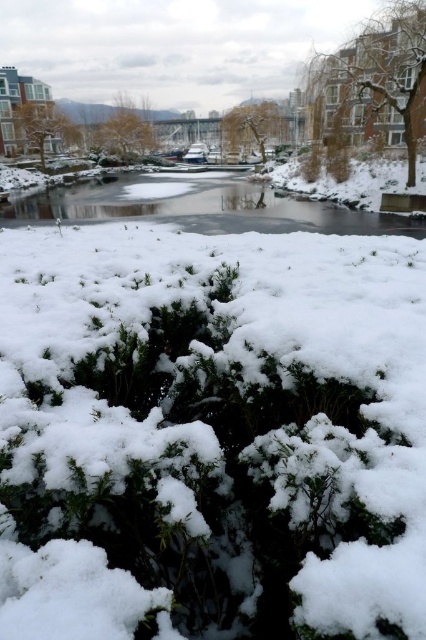
Is point (347, 611) farther from camera compared to point (112, 128)?

No, (347, 611) is in front of (112, 128).

I want to click on white fluffy snow at center, so click(x=212, y=435).

This screenshot has height=640, width=426. I want to click on white fluffy snow at center, so click(212, 435).

Which is more to the right, clear ice water at center or snow-covered tree at upper right?

Positioned to the right is snow-covered tree at upper right.

Locate an element on the screen. The image size is (426, 640). clear ice water at center is located at coordinates (199, 208).

Is point (111, 198) more distant than point (400, 36)?

That is False.

At what (x,y) coordinates should I click in order to perform the action: click on clear ice water at center. Please return your answer as a coordinate pair (x, y). The image size is (426, 640). Looking at the image, I should click on (199, 208).

Looking at this image, does snow-covered tree at center have a greater height compared to brown textured tree at upper center?

Yes, snow-covered tree at center is taller than brown textured tree at upper center.

Does snow-covered tree at center have a larger size compared to brown textured tree at upper center?

Correct, snow-covered tree at center is larger in size than brown textured tree at upper center.

Find the location of `snow-covered tree at center`. snow-covered tree at center is located at coordinates (250, 125).